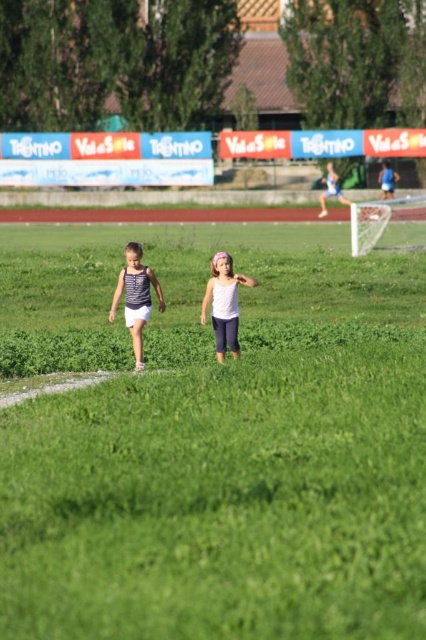
In the scene shown: You are a photographer positioned at the edge of the sports field. You want to capture a photo that includes both the green grass at center and the white matte tank top at center. Based on their positions, which object should you focus on first to ensure both are in clear view?

The green grass at center is in front of the white matte tank top at center. To ensure both are in clear view, focus on the green grass at center first as it is closer to the camera, and the white matte tank top at center will remain in focus due to its position behind.

Consider the image. You are standing at the point marked by the coordinates point (x=213, y=442) in the image. What is the immediate surface you are standing on?

The point (x=213, y=442) indicates green grass at center, so you are standing on green grass at center.

You are a photographer trying to capture the two children in the scene. The green grass at center and the white cotton tank top at center are both in your viewfinder. Which object is closer to the camera?

The white cotton tank top at center is closer to the camera because it is positioned over the green grass at center.